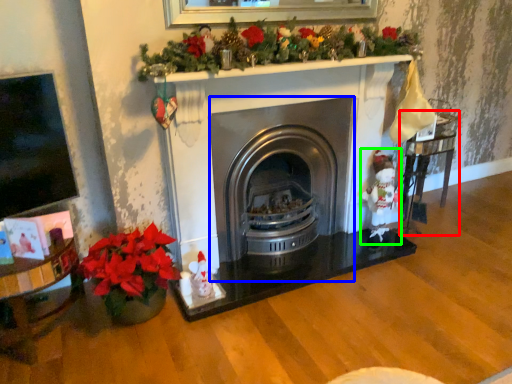
Question: Which is farther away from table (highlighted by a red box)? wood burning stove (highlighted by a blue box) or santa claus (highlighted by a green box)?

Choices:
 (A) wood burning stove
 (B) santa claus

Answer: (A)